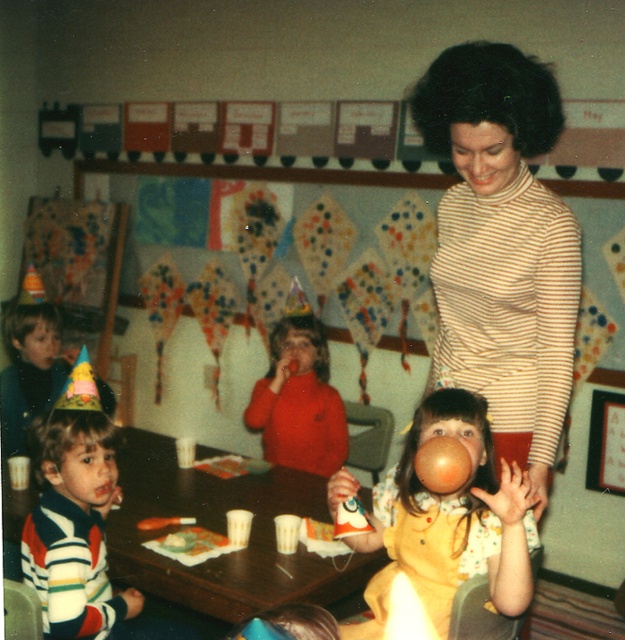
You are a teacher organizing a classroom activity. You have a wooden table at lower center and a striped sweater at lower left. Which object is wider?

The wooden table at lower center is wider than the striped sweater at lower left.

You are a photographer standing 1.5 meters away from the striped turtleneck sweater at center. You want to take a closeup photo of the sweater. Is the camera in your hand already at the right distance?

The striped turtleneck sweater at center and camera are 1.51 meters apart, so the camera is slightly further away than your desired 1.5 meters. Move a tiny bit closer to achieve the perfect distance.